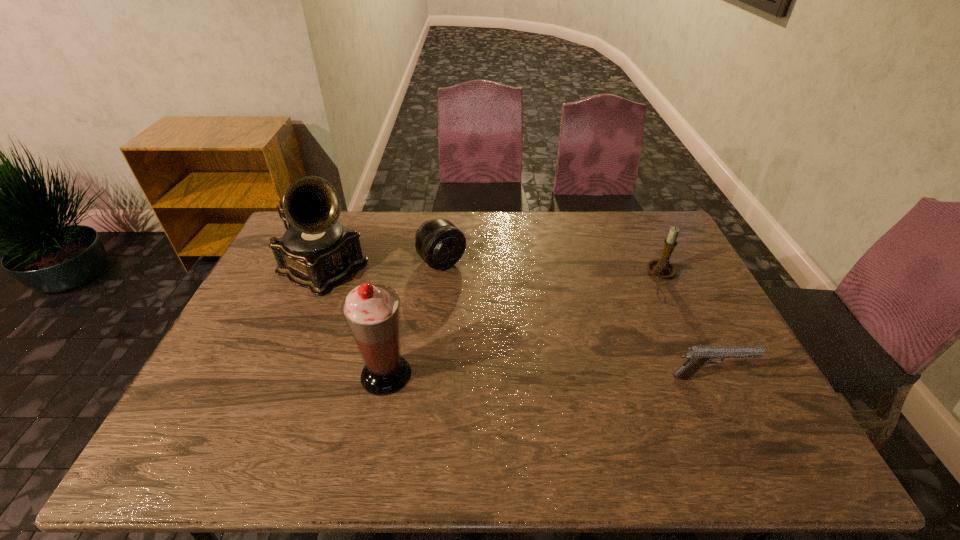
The width and height of the screenshot is (960, 540). In order to click on the fourth shortest object in this screenshot , I will do `click(371, 311)`.

The width and height of the screenshot is (960, 540). Identify the location of pistol. (699, 356).

This screenshot has height=540, width=960. What are the coordinates of `candle holder` in the screenshot? It's located at (662, 268).

Identify the location of the second shortest object. click(x=440, y=244).

Find the location of a particular element. Image resolution: width=960 pixels, height=540 pixels. phonograph record is located at coordinates (316, 252).

This screenshot has width=960, height=540. Identify the location of the tallest object. (316, 252).

Locate an element on the screen. vacant region located on the back of the smoothie is located at coordinates (401, 298).

This screenshot has height=540, width=960. I want to click on free space located 0.080m on the side of the candle holder with the handle, so (x=636, y=289).

Identify the location of vacant space located 0.070m on the side of the candle holder with the handle. (637, 288).

The width and height of the screenshot is (960, 540). Identify the location of free space located 0.330m on the side of the candle holder with the handle. (580, 326).